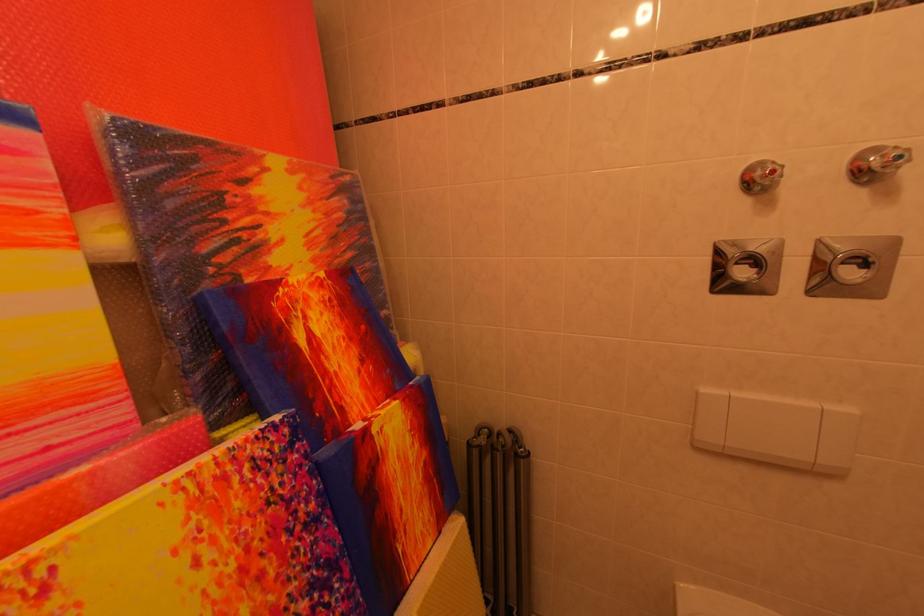
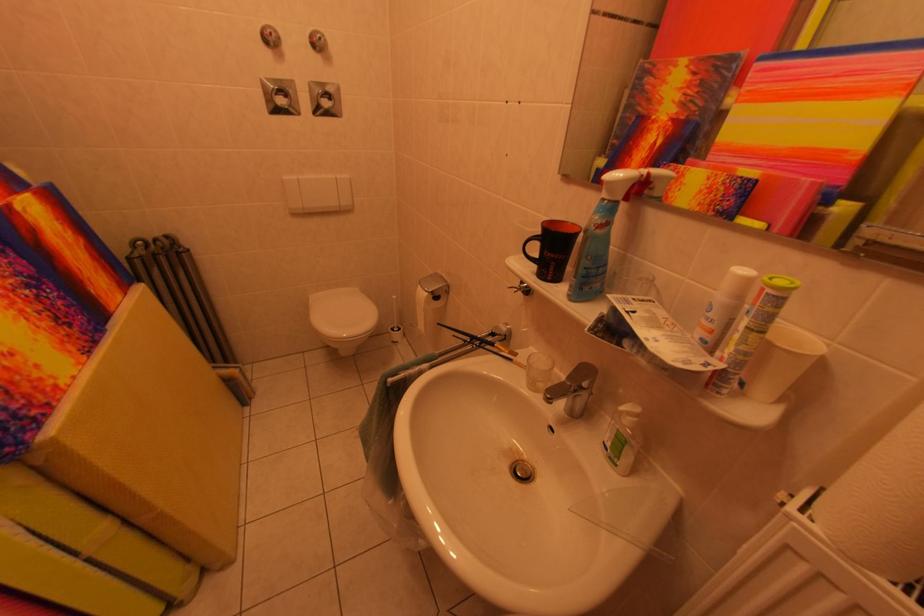
Where in the second image is the point corresponding to [782,176] from the first image?

(278, 39)